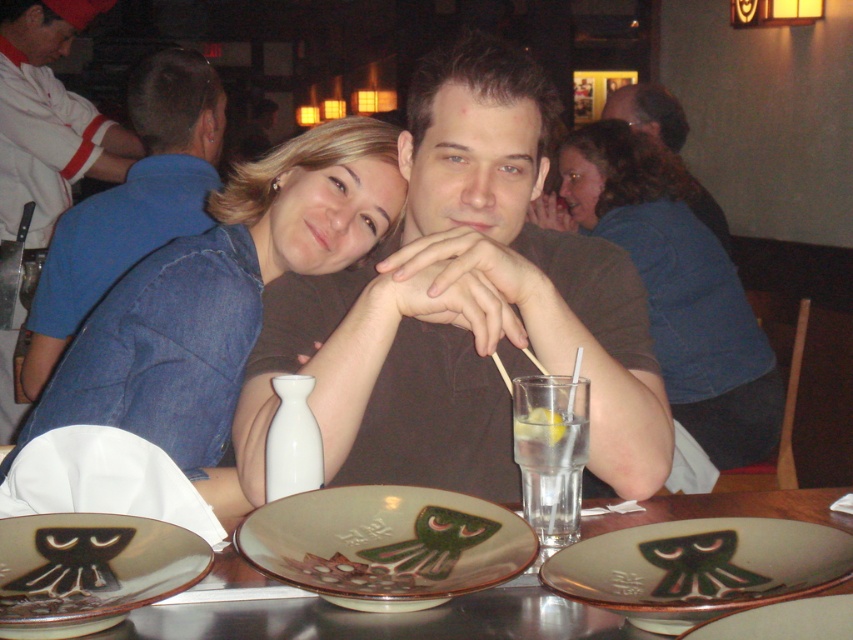
Does green glazed plate at center have a greater width compared to clear glass lemon at center?

Indeed, green glazed plate at center has a greater width compared to clear glass lemon at center.

Which is behind, point (840, 630) or point (543, 413)?

The point (543, 413) is more distant.

Measure the distance between green glazed plate at center and camera.

25.91 inches

The height and width of the screenshot is (640, 853). Find the location of `green glazed plate at center`. green glazed plate at center is located at coordinates tap(782, 620).

Which is in front, point (527, 440) or point (666, 140)?

Point (527, 440)

Can you confirm if clear glass water at table center is shorter than matte brown shirt at upper center?

Yes.

Which is in front, point (540, 429) or point (659, 136)?

Point (540, 429) is in front.

The height and width of the screenshot is (640, 853). Identify the location of clear glass water at table center. (550, 472).

Between point (717, 280) and point (79, 547), which one is positioned behind?

The point (717, 280) is more distant.

Identify the location of blue denim jacket at upper center. Image resolution: width=853 pixels, height=640 pixels. point(677,288).